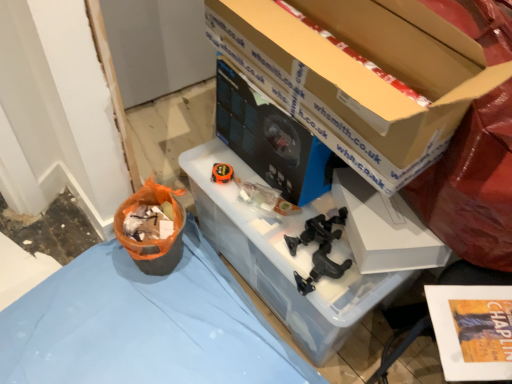
The image size is (512, 384). In order to click on vacant area that is situated to the right of orange rubber tape measure at center, the 1th toy from the left in this screenshot , I will do `click(253, 184)`.